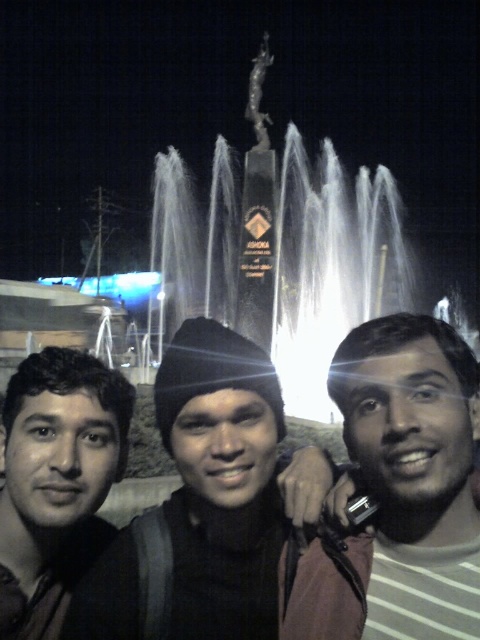
You are standing in front of the fountain and want to take a photo of the silver metallic statue at upper center and the smooth black jacket at center. Which object is positioned to the right of the other?

The smooth black jacket at center is positioned to the right of the silver metallic statue at upper center.

You are a photographer trying to capture a clear shot of both the dark knit cap at center and the smooth black jacket at center. Since you want to focus on the details of both items, which one should you zoom in on more to ensure clarity?

The dark knit cap at center has a larger width than the smooth black jacket at center, so you should zoom in more on the dark knit cap at center to ensure its details are captured clearly.

You are a photographer trying to frame a shot that includes both the smooth black jacket at center and the matte black face at left. Which object should you adjust your focus on first to ensure both are in the frame?

The smooth black jacket at center has a larger width than the matte black face at left, so you should focus on the smooth black jacket at center first to ensure both fit within the frame.